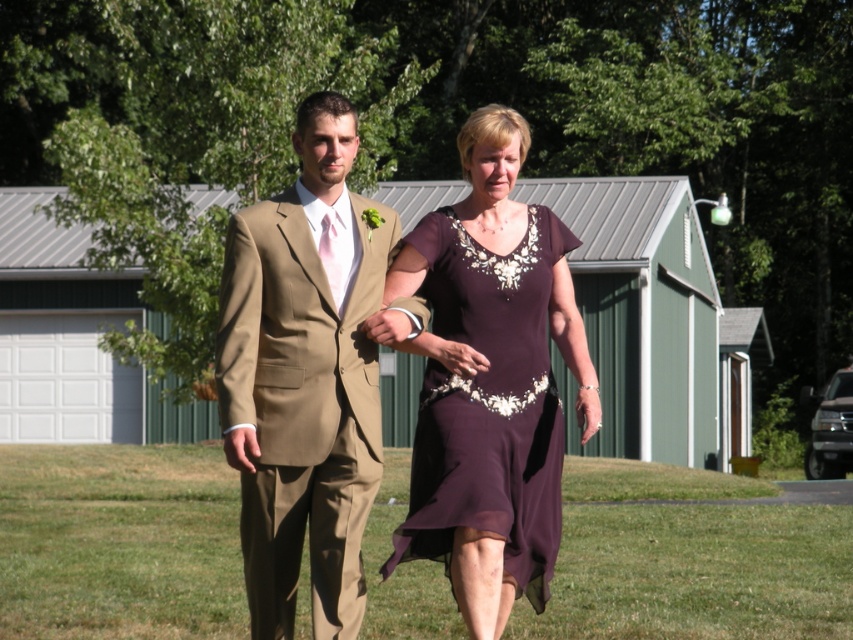
Question: Can you confirm if matte khaki suit at center is bigger than matte purple dress at center?

Choices:
 (A) yes
 (B) no

Answer: (A)

Question: Does dark purple chiffon dress at center appear over matte purple dress at center?

Choices:
 (A) yes
 (B) no

Answer: (B)

Question: Which point is closer to the camera?

Choices:
 (A) matte khaki suit at center
 (B) dark purple chiffon dress at center
 (C) matte purple dress at center

Answer: (A)

Question: Can you confirm if dark purple chiffon dress at center is thinner than matte purple dress at center?

Choices:
 (A) yes
 (B) no

Answer: (B)

Question: Which of the following is the closest to the observer?

Choices:
 (A) (328, 493)
 (B) (456, 333)

Answer: (A)

Question: Which point appears farthest from the camera in this image?

Choices:
 (A) (427, 483)
 (B) (482, 365)
 (C) (323, 486)

Answer: (A)